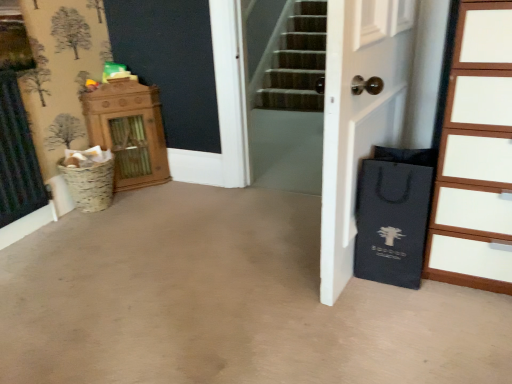
The height and width of the screenshot is (384, 512). Describe the element at coordinates (475, 157) in the screenshot. I see `wooden chest of drawers at right` at that location.

What is the approximate height of black paper bag at right?

black paper bag at right is 20.74 inches in height.

What are the coordinates of `white matte door at center` in the screenshot? It's located at (358, 116).

How different are the orientations of white matte door at center and wooden cabinet at left in degrees?

The angular difference between white matte door at center and wooden cabinet at left is 48.2 degrees.

From the image's perspective, does white matte door at center appear lower than wooden cabinet at left?

Yes.

From a real-world perspective, relative to wooden cabinet at left, is white matte door at center vertically above or below?

From a real-world perspective, white matte door at center is physically above wooden cabinet at left.

Could you tell me if white matte door at center is turned towards wooden cabinet at left?

No, white matte door at center is not oriented towards wooden cabinet at left.

Relative to wooden cabinet at left, is wooden chest of drawers at right in front or behind?

Visually, wooden chest of drawers at right is located in front of wooden cabinet at left.

Is wooden chest of drawers at right oriented away from wooden cabinet at left?

That's not correct — wooden chest of drawers at right is not looking away from wooden cabinet at left.

Is wooden chest of drawers at right not inside wooden cabinet at left?

Absolutely, wooden chest of drawers at right is external to wooden cabinet at left.

How different are the orientations of wooden chest of drawers at right and wooden cabinet at left in degrees?

Answer: 35.1 degrees.

Does wooden cabinet at left turn towards white matte door at center?

No, wooden cabinet at left is not aimed at white matte door at center.

Is wooden cabinet at left placed right next to white matte door at center?

No.

From the picture: Which of these two, wooden cabinet at left or white matte door at center, is thinner?

white matte door at center is thinner.

Between black paper bag at right and wooden chest of drawers at right, which one appears on the right side from the viewer's perspective?

wooden chest of drawers at right.

Is black paper bag at right facing away from wooden chest of drawers at right?

No, black paper bag at right is not facing away from wooden chest of drawers at right.

From the image's perspective, is black paper bag at right above or below wooden chest of drawers at right?

black paper bag at right is below wooden chest of drawers at right.

Locate an element on the screen. This screenshot has height=384, width=512. shopping bag below the wooden chest of drawers at right (from a real-world perspective) is located at coordinates (393, 215).

From a real-world perspective, which is physically above, wooden chest of drawers at right or white matte door at center?

white matte door at center, from a real-world perspective.

Is wooden chest of drawers at right taller or shorter than white matte door at center?

Considering their sizes, wooden chest of drawers at right has less height than white matte door at center.

Visually, is wooden chest of drawers at right positioned to the left or to the right of white matte door at center?

wooden chest of drawers at right is to the right of white matte door at center.

Locate an element on the screen. door behind the wooden chest of drawers at right is located at coordinates (358, 116).

Is there a large distance between wooden cabinet at left and wooden chest of drawers at right?

Yes, wooden cabinet at left is far from wooden chest of drawers at right.

Which is further, (119, 135) or (502, 150)?

The point (119, 135) is farther.

From a real-world perspective, which is physically below, wooden cabinet at left or wooden chest of drawers at right?

wooden cabinet at left.

How much distance is there between wooden cabinet at left and wooden chest of drawers at right?

wooden cabinet at left and wooden chest of drawers at right are 6.09 feet apart.

Locate an element on the screen. This screenshot has height=384, width=512. the chest of drawers above the black paper bag at right (from the image's perspective) is located at coordinates tap(475, 157).

Can you confirm if wooden chest of drawers at right is taller than black paper bag at right?

Yes, wooden chest of drawers at right is taller than black paper bag at right.

Consider the image. Does wooden chest of drawers at right come behind black paper bag at right?

No, the depth of wooden chest of drawers at right is less than that of black paper bag at right.

The height and width of the screenshot is (384, 512). In order to click on door lying in front of the wooden cabinet at left in this screenshot , I will do `click(358, 116)`.

The width and height of the screenshot is (512, 384). Identify the location of dresser behind the wooden chest of drawers at right. (129, 131).

Which object lies further to the anchor point black paper bag at right, white matte door at center or wooden cabinet at left?

wooden cabinet at left is positioned further to the anchor black paper bag at right.

From the image, which object appears to be nearer to wooden chest of drawers at right, white matte door at center or black paper bag at right?

black paper bag at right is positioned closer to the anchor wooden chest of drawers at right.

Estimate the real-world distances between objects in this image. Which object is further from wooden cabinet at left, wooden chest of drawers at right or black paper bag at right?

The object further to wooden cabinet at left is wooden chest of drawers at right.

Based on their spatial positions, is black paper bag at right or white matte door at center closer to wooden cabinet at left?

Based on the image, white matte door at center appears to be nearer to wooden cabinet at left.

Looking at the image, which one is located closer to wooden cabinet at left, white matte door at center or black paper bag at right?

white matte door at center lies closer to wooden cabinet at left than the other object.

Considering their positions, is wooden cabinet at left positioned closer to white matte door at center than black paper bag at right?

black paper bag at right lies closer to white matte door at center than the other object.

Considering their positions, is wooden chest of drawers at right positioned further to white matte door at center than black paper bag at right?

Based on the image, wooden chest of drawers at right appears to be further to white matte door at center.

Considering their positions, is white matte door at center positioned further to wooden cabinet at left than wooden chest of drawers at right?

wooden chest of drawers at right.

You are a GUI agent. You are given a task and a screenshot of the screen. Output one action in this format:
    pyautogui.click(x=<x>, y=<y>)
    Task: Click on the door between wooden cabinet at left and black paper bag at right from left to right
    The height and width of the screenshot is (384, 512).
    Given the screenshot: What is the action you would take?
    pyautogui.click(x=358, y=116)

The height and width of the screenshot is (384, 512). Find the location of `door located between wooden cabinet at left and wooden chest of drawers at right in the left-right direction`. door located between wooden cabinet at left and wooden chest of drawers at right in the left-right direction is located at coordinates (358, 116).

This screenshot has height=384, width=512. Find the location of `shopping bag between white matte door at center and wooden chest of drawers at right`. shopping bag between white matte door at center and wooden chest of drawers at right is located at coordinates (393, 215).

Where is `shopping bag between wooden cabinet at left and wooden chest of drawers at right in the horizontal direction`? This screenshot has height=384, width=512. shopping bag between wooden cabinet at left and wooden chest of drawers at right in the horizontal direction is located at coordinates (393, 215).